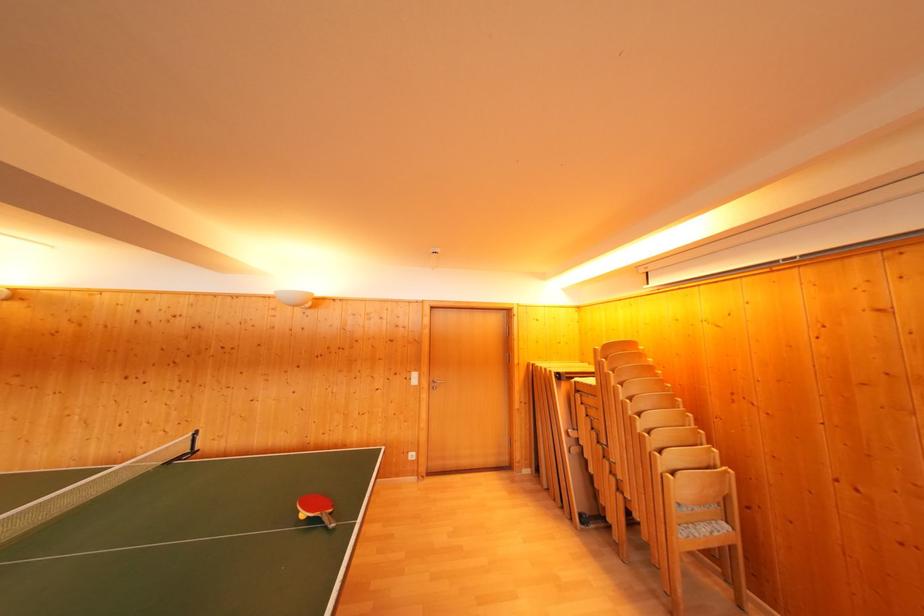
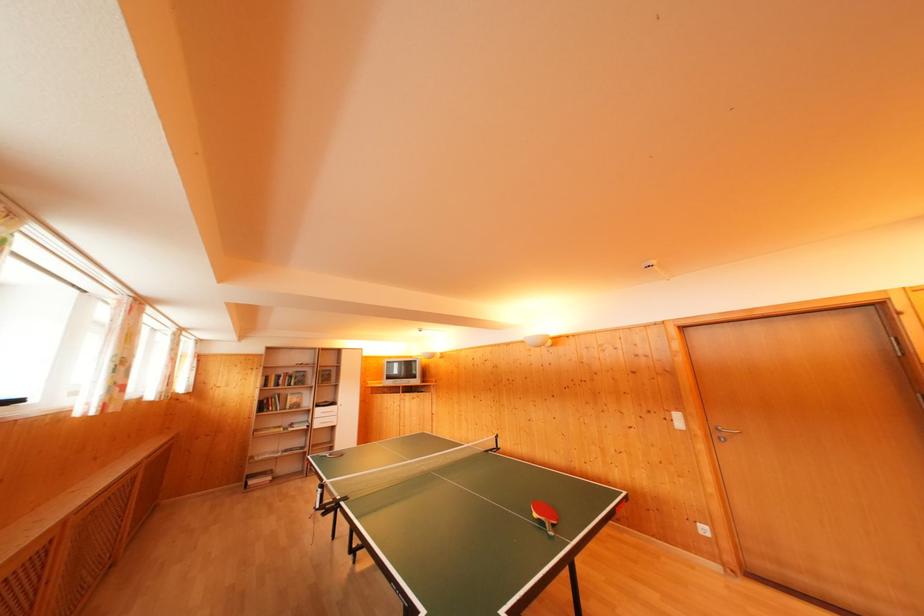
Where in the second image is the point corresponding to (308,521) from the first image?

(541, 521)